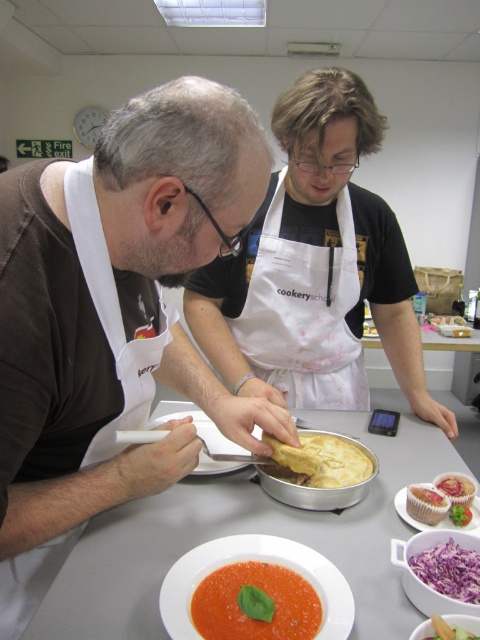
Is point (338, 554) farther from viewer compared to point (199, 474)?

No.

What do you see at coordinates (251, 531) in the screenshot? The image size is (480, 640). I see `white matte table at center` at bounding box center [251, 531].

Which is behind, point (132, 598) or point (213, 444)?

Positioned behind is point (213, 444).

Find the location of a particular element. white matte table at center is located at coordinates (251, 531).

Is golden flaky pie at center bigger than matte white cupcake at lower right?

Yes.

In the scene shown: Which is more to the right, golden flaky pie at center or matte white cupcake at lower right?

Positioned to the right is matte white cupcake at lower right.

The image size is (480, 640). I want to click on golden flaky pie at center, so click(x=324, y=460).

You are a GUI agent. You are given a task and a screenshot of the screen. Output one action in this format:
    pyautogui.click(x=<x>, y=<y>)
    Task: Click on the golden flaky pie at center
    
    Given the screenshot: What is the action you would take?
    pyautogui.click(x=324, y=460)

Is point (135, 420) positioned behind point (451, 496)?

No, (135, 420) is in front of (451, 496).

Which is above, matte brown apron at left or matte white cupcake at lower right?

matte brown apron at left is above.

Locate an element on the screen. matte brown apron at left is located at coordinates (112, 317).